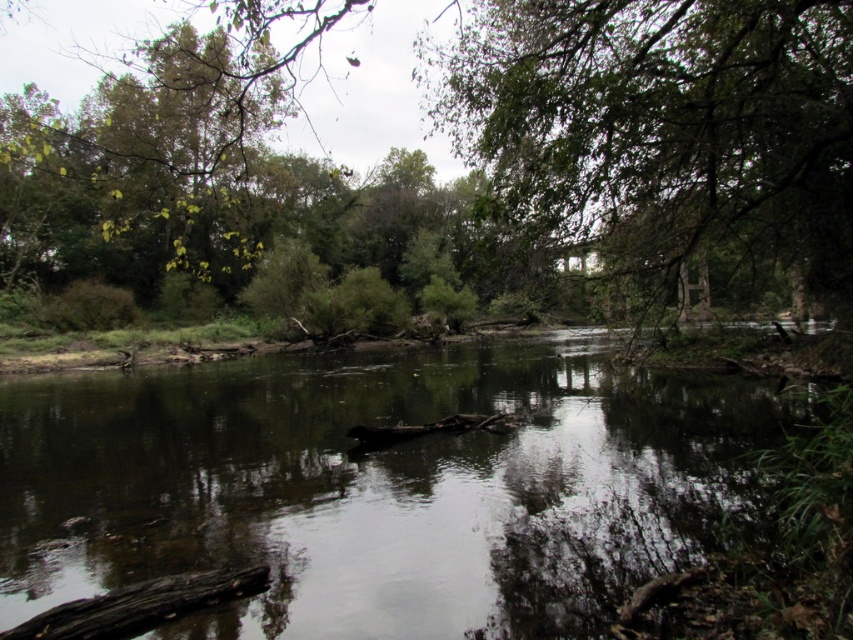
Question: Can you confirm if smooth reflective water at center is positioned above green leafy tree at upper center?

Choices:
 (A) yes
 (B) no

Answer: (B)

Question: Which point is farther to the camera?

Choices:
 (A) (637, 38)
 (B) (57, 621)
 (C) (73, 400)

Answer: (C)

Question: Which of these objects is positioned farthest from the smooth reflective water at center?

Choices:
 (A) green leafy tree at upper center
 (B) dark brown wood log at lower left

Answer: (A)

Question: Is the position of smooth reflective water at center less distant than that of green leafy tree at upper center?

Choices:
 (A) yes
 (B) no

Answer: (A)

Question: Considering the relative positions of smooth reflective water at center and dark brown wood log at lower left in the image provided, where is smooth reflective water at center located with respect to dark brown wood log at lower left?

Choices:
 (A) below
 (B) above

Answer: (B)

Question: Which object is closer to the camera taking this photo?

Choices:
 (A) smooth reflective water at center
 (B) green leafy tree at upper center
 (C) dark brown wood log at lower left

Answer: (C)